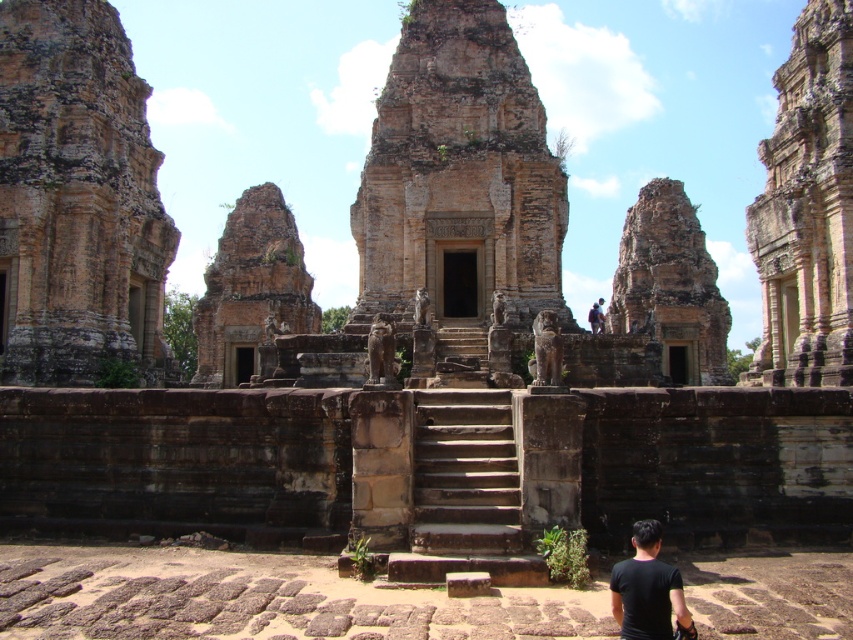
Between rustic stone tower at left and rusty stone ruin at center, which one appears on the left side from the viewer's perspective?

rustic stone tower at left is more to the left.

Which is in front, point (24, 288) or point (273, 291)?

Point (24, 288) is more forward.

Where is `rustic stone tower at left`? The height and width of the screenshot is (640, 853). rustic stone tower at left is located at coordinates (77, 200).

Does point (10, 129) come in front of point (445, 474)?

No.

Which is behind, point (123, 193) or point (453, 515)?

The point (123, 193) is behind.

In order to click on rustic stone tower at left in this screenshot , I will do `click(77, 200)`.

Who is taller, rustic stone tower at right or black matte shirt at lower right?

With more height is rustic stone tower at right.

This screenshot has width=853, height=640. What do you see at coordinates (807, 209) in the screenshot? I see `rustic stone tower at right` at bounding box center [807, 209].

You are a GUI agent. You are given a task and a screenshot of the screen. Output one action in this format:
    pyautogui.click(x=<x>, y=<y>)
    Task: Click on the rustic stone tower at right
    
    Given the screenshot: What is the action you would take?
    pyautogui.click(x=807, y=209)